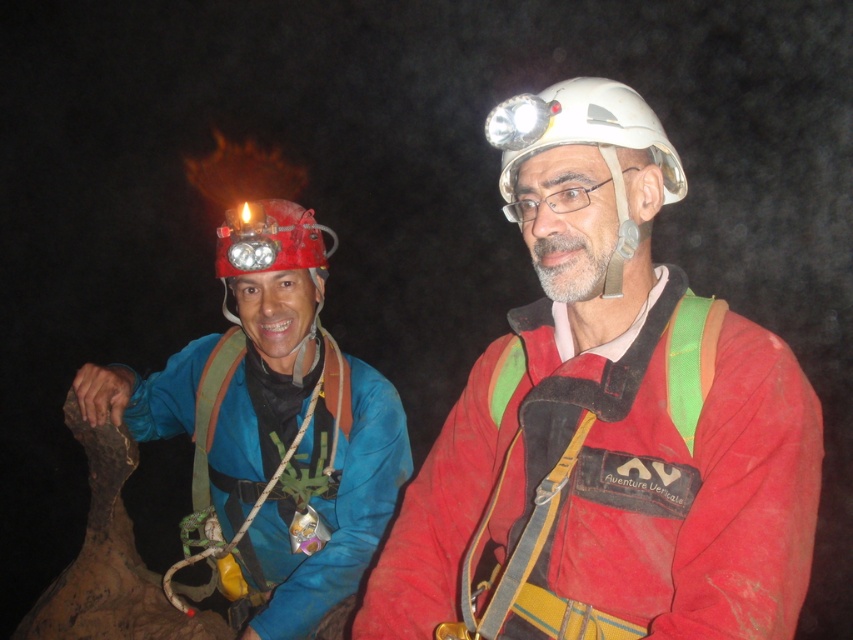
You are standing in front of the two climbers in the cave. You want to move closer to the point that is nearer to you. Which point should you move towards, point (402, 611) or point (376, 460)?

You should move towards point (402, 611) because it is closer to you than point (376, 460).

You are a cave explorer trying to locate your team member wearing a matte red jacket at center. According to the coordinates provided, where should you look to find them?

The matte red jacket at center is located at coordinates point (606, 422).

From the picture: You are planning to hang a large poster on the wall behind the matte red jacket at center and the matte blue jacket at left. Which jacket should you avoid placing the poster too close to if you want to ensure there is enough space for the poster?

The matte red jacket at center occupies less space than the matte blue jacket at left, so you should avoid placing the poster too close to the matte blue jacket at left to ensure enough space.